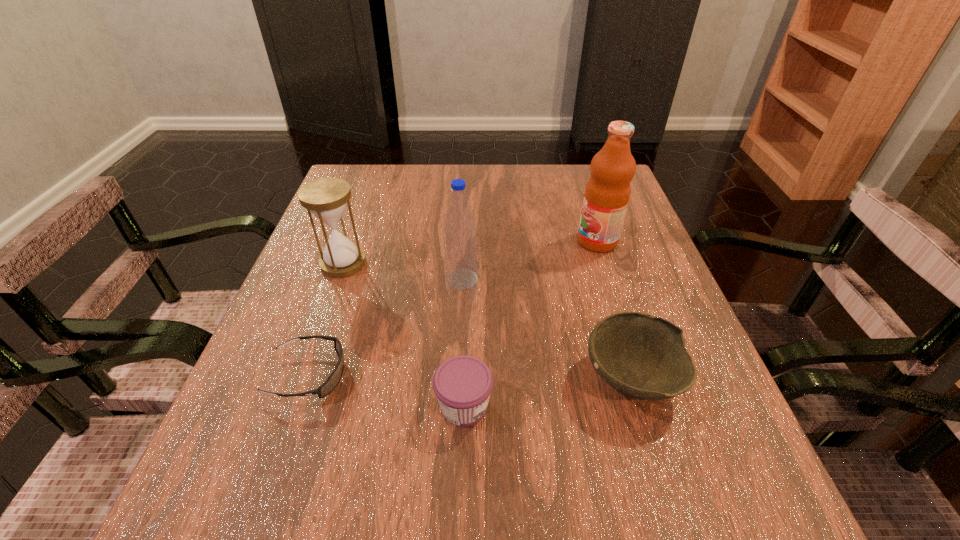
In the image, there is a desktop. In order to click on free space at the left edge in this screenshot , I will do `click(309, 331)`.

At what (x,y) coordinates should I click in order to perform the action: click on vacant space at the right edge of the desktop. Please return your answer as a coordinate pair (x, y). The height and width of the screenshot is (540, 960). Looking at the image, I should click on (595, 291).

Identify the location of free space at the near left corner of the desktop. (268, 509).

Image resolution: width=960 pixels, height=540 pixels. Find the location of `vacant region at the near right corner of the desktop`. vacant region at the near right corner of the desktop is located at coordinates (662, 489).

The width and height of the screenshot is (960, 540). In order to click on blank region between the fourth shortest object and the jam in this screenshot , I will do `click(404, 335)`.

Where is `vacant area that lies between the bowl and the tallest object`? The height and width of the screenshot is (540, 960). vacant area that lies between the bowl and the tallest object is located at coordinates (614, 310).

At what (x,y) coordinates should I click in order to perform the action: click on blank region between the bowl and the third tallest object. Please return your answer as a coordinate pair (x, y). Looking at the image, I should click on (487, 321).

Locate an element on the screen. The image size is (960, 540). free space between the shortest object and the fruit juice is located at coordinates (453, 308).

You are a GUI agent. You are given a task and a screenshot of the screen. Output one action in this format:
    pyautogui.click(x=<x>, y=<y>)
    Task: Click on the free space between the jam and the tallest object
    
    Given the screenshot: What is the action you would take?
    pyautogui.click(x=531, y=323)

Identify the location of free space that is in between the second tallest object and the fourth shortest object. (402, 272).